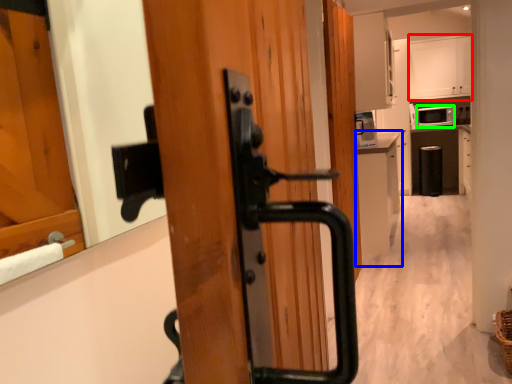
Question: Which is nearer to the cabinetry (highlighted by a red box)? cabinetry (highlighted by a blue box) or appliance (highlighted by a green box).

Choices:
 (A) cabinetry
 (B) appliance

Answer: (B)